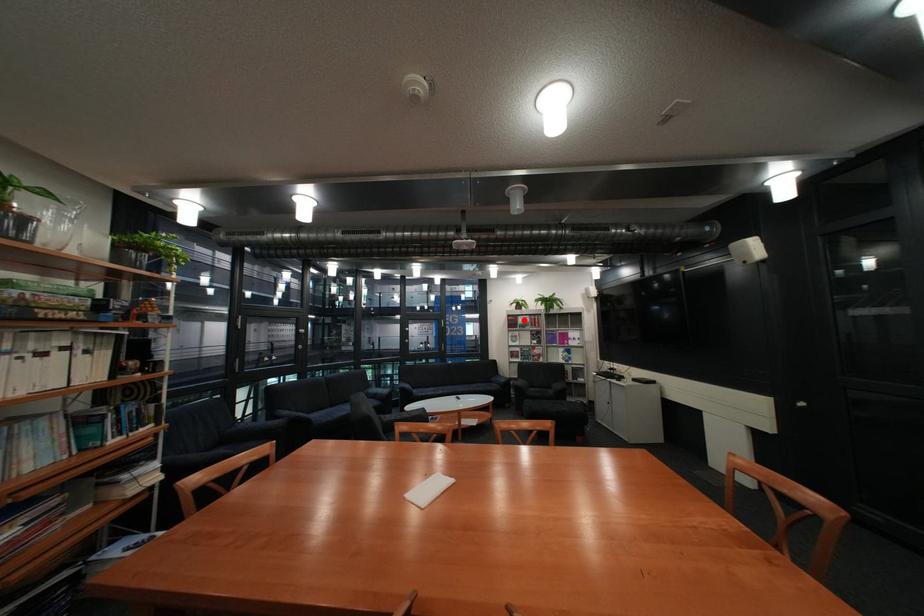
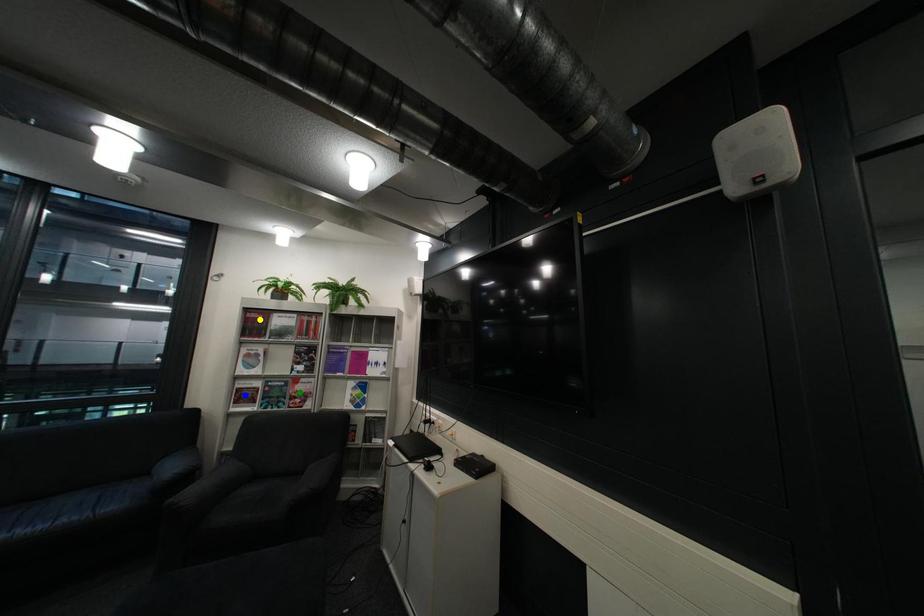
Question: I am providing you with two images of the same scene from different viewpoints. A red point is marked on the first image. You are given multiple points on the second image. Which point in image 2 is actually the same real-world point as the red point in image 1?

Choices:
 (A) yellow point
 (B) blue point
 (C) green point

Answer: (A)